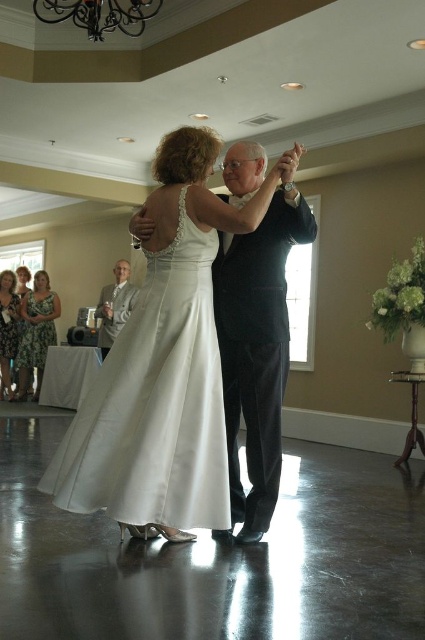
Does black satin suit at center have a lesser width compared to white satin dress at lower left?

In fact, black satin suit at center might be wider than white satin dress at lower left.

Between black satin suit at center and white satin dress at lower left, which one is positioned lower?

Positioned lower is black satin suit at center.

At what (x,y) coordinates should I click in order to perform the action: click on black satin suit at center. Please return your answer as a coordinate pair (x, y). The image size is (425, 640). Looking at the image, I should click on (257, 346).

Does point (127, 262) lie in front of point (8, 333)?

Yes, point (127, 262) is in front of point (8, 333).

Is point (113, 272) behind point (19, 323)?

No, (113, 272) is in front of (19, 323).

Image resolution: width=425 pixels, height=640 pixels. What are the coordinates of `gray suit at left` in the screenshot? It's located at (115, 305).

What do you see at coordinates (155, 404) in the screenshot? I see `satin white dress at center` at bounding box center [155, 404].

Does satin white dress at center have a greater height compared to black satin suit at center?

No, satin white dress at center is not taller than black satin suit at center.

Which is in front, point (155, 269) or point (235, 301)?

Point (155, 269) is more forward.

Where is `satin white dress at center`? Image resolution: width=425 pixels, height=640 pixels. satin white dress at center is located at coordinates (155, 404).